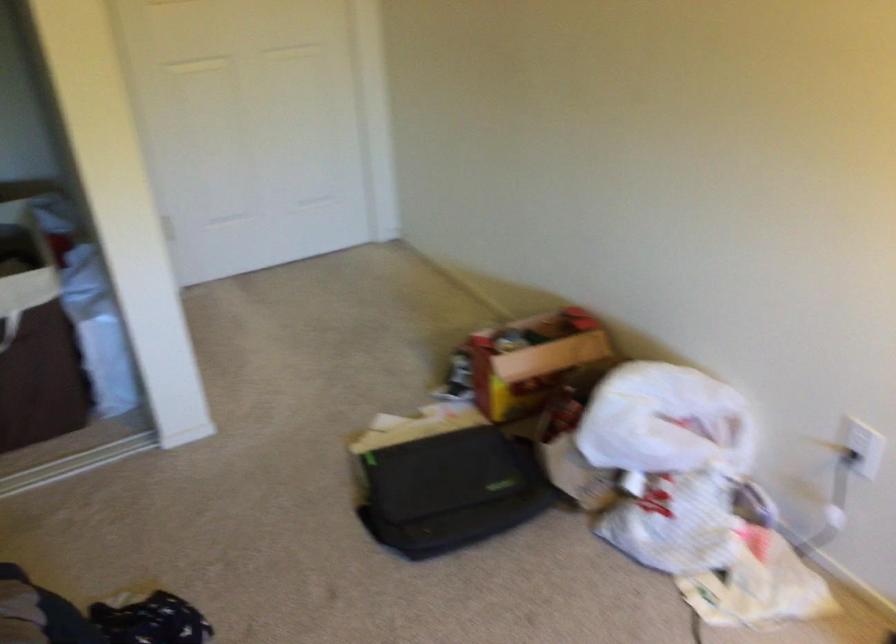
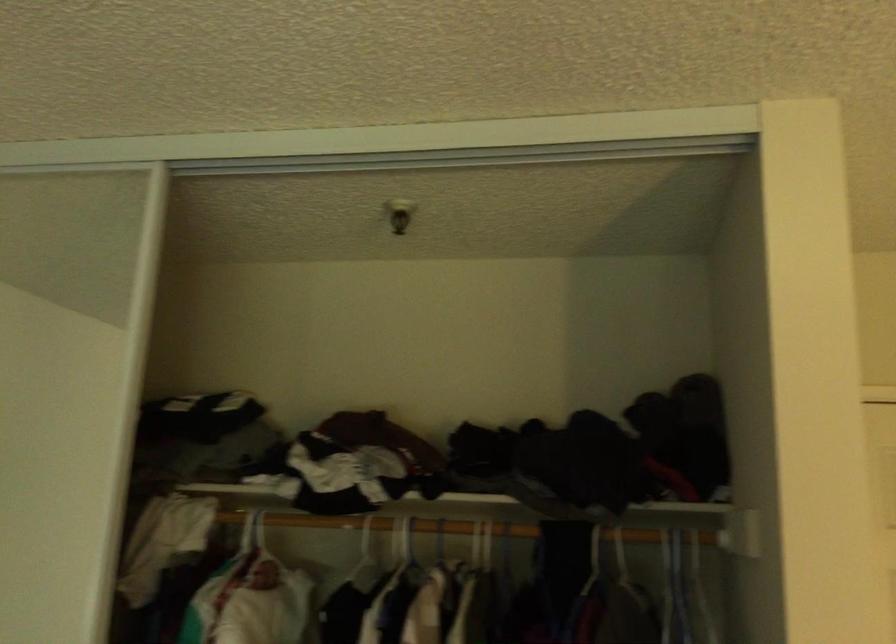
The images are taken continuously from a first-person perspective. In which direction is your viewpoint rotating?

The rotation direction of the camera is left-up.